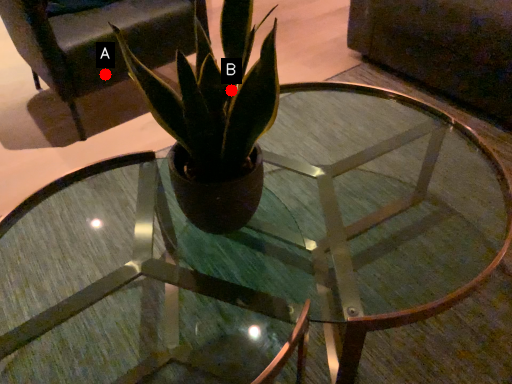
Question: Two points are circled on the image, labeled by A and B beside each circle. Among these points, which one is nearest to the camera?

Choices:
 (A) A is closer
 (B) B is closer

Answer: (B)